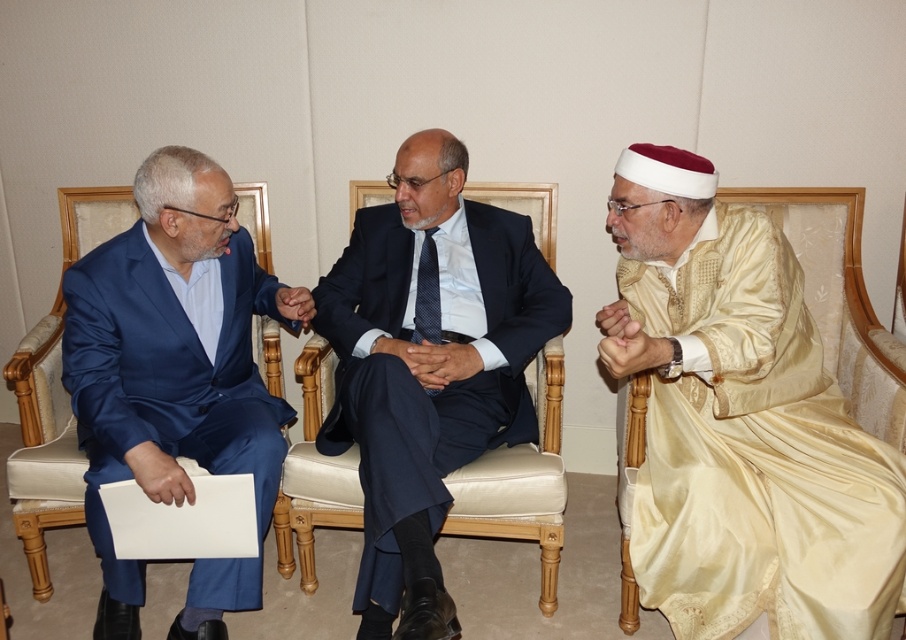
Who is higher up, gold satin robe at right or matte black suit at center?

matte black suit at center

Which of these two, gold satin robe at right or matte black suit at center, stands taller?

With more height is matte black suit at center.

Is point (796, 390) behind point (363, 220)?

No, (796, 390) is closer to viewer.

Where is `gold satin robe at right`? The height and width of the screenshot is (640, 906). gold satin robe at right is located at coordinates (741, 422).

Does matte black suit at center appear on the right side of satin blue suit at left?

Indeed, matte black suit at center is positioned on the right side of satin blue suit at left.

Is point (489, 230) less distant than point (112, 582)?

That is False.

Is point (511, 276) positioned after point (133, 269)?

Yes, point (511, 276) is behind point (133, 269).

Identify the location of matte black suit at center. The width and height of the screenshot is (906, 640). (x=429, y=365).

Can you confirm if gold satin robe at right is thinner than satin blue suit at left?

Incorrect, gold satin robe at right's width is not less than satin blue suit at left's.

Find the location of `gold satin robe at right`. gold satin robe at right is located at coordinates (741, 422).

You are a GUI agent. You are given a task and a screenshot of the screen. Output one action in this format:
    pyautogui.click(x=<x>, y=<y>)
    Task: Click on the gold satin robe at right
    
    Given the screenshot: What is the action you would take?
    pyautogui.click(x=741, y=422)

The width and height of the screenshot is (906, 640). What are the coordinates of `gold satin robe at right` in the screenshot? It's located at (741, 422).